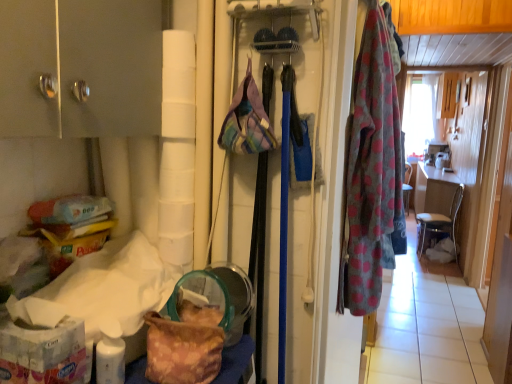
Question: Can you confirm if plaid fabric handbag at center, marked as the 2th handbag in a left-to-right arrangement, is thinner than polka dot fabric robe at right?

Choices:
 (A) yes
 (B) no

Answer: (A)

Question: From the image's perspective, is plaid fabric handbag at center, the 1th handbag from the top, above polka dot fabric robe at right?

Choices:
 (A) yes
 (B) no

Answer: (A)

Question: Is polka dot fabric robe at right surrounded by plaid fabric handbag at center, marked as the 1th handbag in a right-to-left arrangement?

Choices:
 (A) no
 (B) yes

Answer: (A)

Question: Is plaid fabric handbag at center, marked as the 2th handbag in a left-to-right arrangement, not inside polka dot fabric robe at right?

Choices:
 (A) no
 (B) yes

Answer: (B)

Question: Is plaid fabric handbag at center, marked as the 1th handbag in a right-to-left arrangement, positioned behind polka dot fabric robe at right?

Choices:
 (A) no
 (B) yes

Answer: (A)

Question: From the image's perspective, is plaid fabric handbag at center, marked as the 1th handbag in a right-to-left arrangement, below camouflage fabric bag at lower left, the 1th handbag when ordered from bottom to top?

Choices:
 (A) no
 (B) yes

Answer: (A)

Question: Is plaid fabric handbag at center, which is the second handbag in bottom-to-top order, at the left side of camouflage fabric bag at lower left, positioned as the 2th handbag in top-to-bottom order?

Choices:
 (A) yes
 (B) no

Answer: (B)

Question: From the image's perspective, would you say plaid fabric handbag at center, marked as the 2th handbag in a left-to-right arrangement, is positioned over camouflage fabric bag at lower left, the first handbag in the left-to-right sequence?

Choices:
 (A) no
 (B) yes

Answer: (B)

Question: Does plaid fabric handbag at center, the 1th handbag from the top, have a lesser height compared to camouflage fabric bag at lower left, the 2th handbag in the right-to-left sequence?

Choices:
 (A) yes
 (B) no

Answer: (B)

Question: Considering the relative sizes of plaid fabric handbag at center, which is the second handbag in bottom-to-top order, and camouflage fabric bag at lower left, positioned as the 2th handbag in top-to-bottom order, in the image provided, is plaid fabric handbag at center, which is the second handbag in bottom-to-top order, taller than camouflage fabric bag at lower left, positioned as the 2th handbag in top-to-bottom order,?

Choices:
 (A) no
 (B) yes

Answer: (B)

Question: Can you confirm if plaid fabric handbag at center, marked as the 2th handbag in a left-to-right arrangement, is smaller than camouflage fabric bag at lower left, the first handbag in the left-to-right sequence?

Choices:
 (A) no
 (B) yes

Answer: (A)

Question: Can you confirm if polka dot fabric robe at right is thinner than matte silver cabinet at upper left?

Choices:
 (A) no
 (B) yes

Answer: (B)